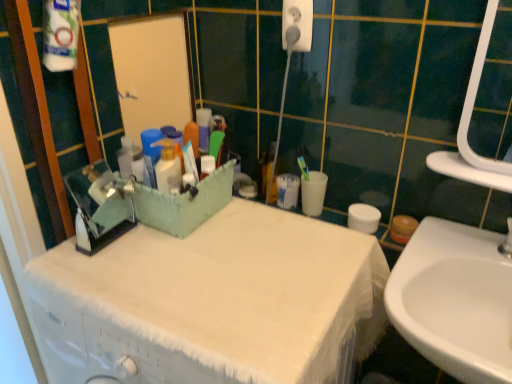
Where is `free spot above white fabric-covered cabinet at center (from a real-world perspective)`? The height and width of the screenshot is (384, 512). free spot above white fabric-covered cabinet at center (from a real-world perspective) is located at coordinates (211, 258).